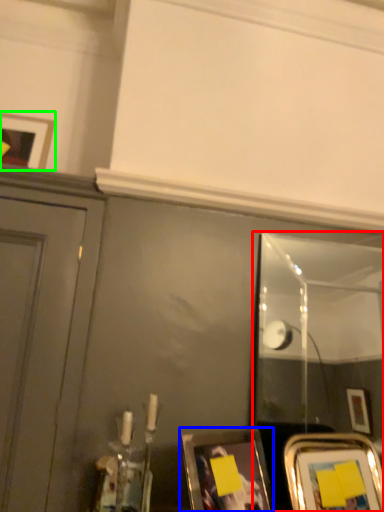
Question: Which object is positioned closest to mirror (highlighted by a red box)? Select from picture frame (highlighted by a blue box) and picture frame (highlighted by a green box).

Choices:
 (A) picture frame
 (B) picture frame

Answer: (A)